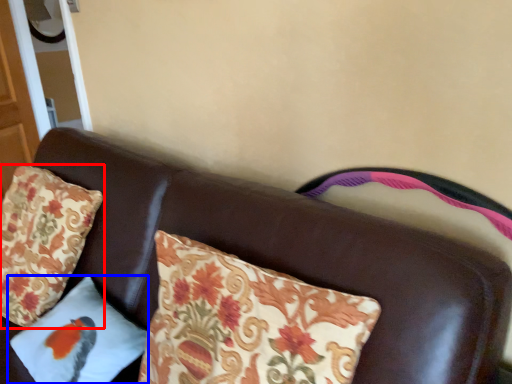
Question: Which of the following is the closest to the observer, pillow (highlighted by a red box) or pillow (highlighted by a blue box)?

Choices:
 (A) pillow
 (B) pillow

Answer: (B)